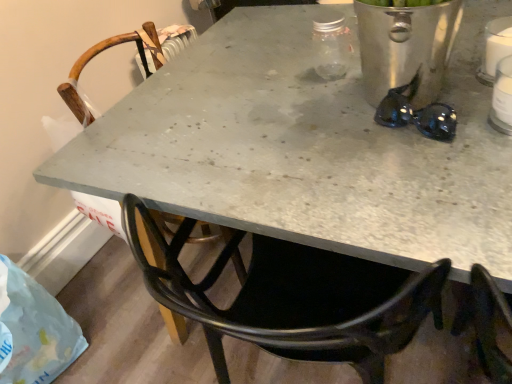
What do you see at coordinates (416, 114) in the screenshot? I see `black shiny sunglasses at upper right` at bounding box center [416, 114].

What do you see at coordinates (99, 53) in the screenshot? I see `wooden chair at center` at bounding box center [99, 53].

Where is `wooden chair at center`? The width and height of the screenshot is (512, 384). wooden chair at center is located at coordinates (99, 53).

Where is `translucent plastic bag at lower left`? The width and height of the screenshot is (512, 384). translucent plastic bag at lower left is located at coordinates (33, 330).

Locate an element on the screen. This screenshot has height=384, width=512. black shiny sunglasses at upper right is located at coordinates (416, 114).

Which is less distant, (495, 89) or (419, 126)?

Positioned in front is point (419, 126).

Looking at the image, does white plastic bottle at upper right seem bigger or smaller compared to black shiny sunglasses at upper right?

Clearly, white plastic bottle at upper right is larger in size than black shiny sunglasses at upper right.

From the image's perspective, between white plastic bottle at upper right and black shiny sunglasses at upper right, which one is located above?

white plastic bottle at upper right is shown above in the image.

Which object is thinner, black shiny sunglasses at upper right or translucent plastic bag at lower left?

With smaller width is black shiny sunglasses at upper right.

In the scene shown: Between black shiny sunglasses at upper right and translucent plastic bag at lower left, which one appears on the right side from the viewer's perspective?

Positioned to the right is black shiny sunglasses at upper right.

Considering the relative sizes of black shiny sunglasses at upper right and translucent plastic bag at lower left in the image provided, is black shiny sunglasses at upper right shorter than translucent plastic bag at lower left?

Indeed, black shiny sunglasses at upper right has a lesser height compared to translucent plastic bag at lower left.

In order to click on appliance to the right of translucent plastic bag at lower left in this screenshot , I will do `click(502, 98)`.

Considering their positions, is translucent plastic bag at lower left located in front of or behind white plastic bottle at upper right?

Visually, translucent plastic bag at lower left is located behind white plastic bottle at upper right.

Consider the image. From the image's perspective, is translucent plastic bag at lower left located beneath white plastic bottle at upper right?

Yes, from the image's perspective, translucent plastic bag at lower left is beneath white plastic bottle at upper right.

Which object is thinner, white plastic bottle at upper right or translucent plastic bag at lower left?

Thinner between the two is white plastic bottle at upper right.

Do you think white plastic bottle at upper right is within translucent plastic bag at lower left, or outside of it?

white plastic bottle at upper right is outside translucent plastic bag at lower left.

In terms of height, does white plastic bottle at upper right look taller or shorter compared to translucent plastic bag at lower left?

Considering their sizes, white plastic bottle at upper right has less height than translucent plastic bag at lower left.

Does point (507, 123) come behind point (25, 285)?

No, (507, 123) is closer to viewer.

Who is bigger, translucent plastic bag at lower left or black shiny sunglasses at upper right?

translucent plastic bag at lower left.

Is translucent plastic bag at lower left shorter than black shiny sunglasses at upper right?

No, translucent plastic bag at lower left is not shorter than black shiny sunglasses at upper right.

From a real-world perspective, is translucent plastic bag at lower left positioned under black shiny sunglasses at upper right based on gravity?

Indeed, from a real-world perspective, translucent plastic bag at lower left is positioned beneath black shiny sunglasses at upper right.

Which object is further away from the camera taking this photo, translucent plastic bag at lower left or black shiny sunglasses at upper right?

translucent plastic bag at lower left is behind.

Considering the relative sizes of translucent plastic bag at lower left and wooden chair at center in the image provided, is translucent plastic bag at lower left bigger than wooden chair at center?

No, translucent plastic bag at lower left is not bigger than wooden chair at center.

Is translucent plastic bag at lower left turned away from wooden chair at center?

No, translucent plastic bag at lower left is not facing away from wooden chair at center.

The image size is (512, 384). I want to click on appliance lying above the black shiny sunglasses at upper right (from the image's perspective), so click(502, 98).

Considering the relative positions of black shiny sunglasses at upper right and white plastic bottle at upper right in the image provided, is black shiny sunglasses at upper right to the left or to the right of white plastic bottle at upper right?

black shiny sunglasses at upper right is positioned on white plastic bottle at upper right's left side.

Between black shiny sunglasses at upper right and white plastic bottle at upper right, which one has larger width?

Wider between the two is white plastic bottle at upper right.

At what (x,y) coordinates should I click in order to perform the action: click on glasses that appears on the left of white plastic bottle at upper right. Please return your answer as a coordinate pair (x, y). The width and height of the screenshot is (512, 384). Looking at the image, I should click on (416, 114).

Locate an element on the screen. Image resolution: width=512 pixels, height=384 pixels. glasses that is above the translucent plastic bag at lower left (from the image's perspective) is located at coordinates 416,114.

Estimate the real-world distances between objects in this image. Which object is closer to white plastic bottle at upper right, wooden chair at center or black shiny sunglasses at upper right?

Based on the image, black shiny sunglasses at upper right appears to be nearer to white plastic bottle at upper right.

Based on their spatial positions, is wooden chair at center or black shiny sunglasses at upper right closer to translucent plastic bag at lower left?

wooden chair at center is positioned closer to the anchor translucent plastic bag at lower left.

Estimate the real-world distances between objects in this image. Which object is further from translucent plastic bag at lower left, wooden chair at center or white plastic bottle at upper right?

white plastic bottle at upper right is further to translucent plastic bag at lower left.

Which object lies further to the anchor point translucent plastic bag at lower left, black shiny sunglasses at upper right or wooden chair at center?

The object further to translucent plastic bag at lower left is black shiny sunglasses at upper right.

When comparing their distances from translucent plastic bag at lower left, does white plastic bottle at upper right or black shiny sunglasses at upper right seem further?

white plastic bottle at upper right.

From the image, which object appears to be farther from black shiny sunglasses at upper right, white plastic bottle at upper right or wooden chair at center?

wooden chair at center lies further to black shiny sunglasses at upper right than the other object.

From the image, which object appears to be farther from wooden chair at center, white plastic bottle at upper right or translucent plastic bag at lower left?

white plastic bottle at upper right.

From the image, which object appears to be farther from white plastic bottle at upper right, black shiny sunglasses at upper right or translucent plastic bag at lower left?

Based on the image, translucent plastic bag at lower left appears to be further to white plastic bottle at upper right.

At what (x,y) coordinates should I click in order to perform the action: click on glasses between wooden chair at center and white plastic bottle at upper right. Please return your answer as a coordinate pair (x, y). Looking at the image, I should click on click(416, 114).

This screenshot has height=384, width=512. Identify the location of glasses between translucent plastic bag at lower left and white plastic bottle at upper right. (416, 114).

I want to click on chair between translucent plastic bag at lower left and white plastic bottle at upper right in the horizontal direction, so click(x=99, y=53).

What are the coordinates of `chair between translucent plastic bag at lower left and black shiny sunglasses at upper right in the horizontal direction` in the screenshot? It's located at (99, 53).